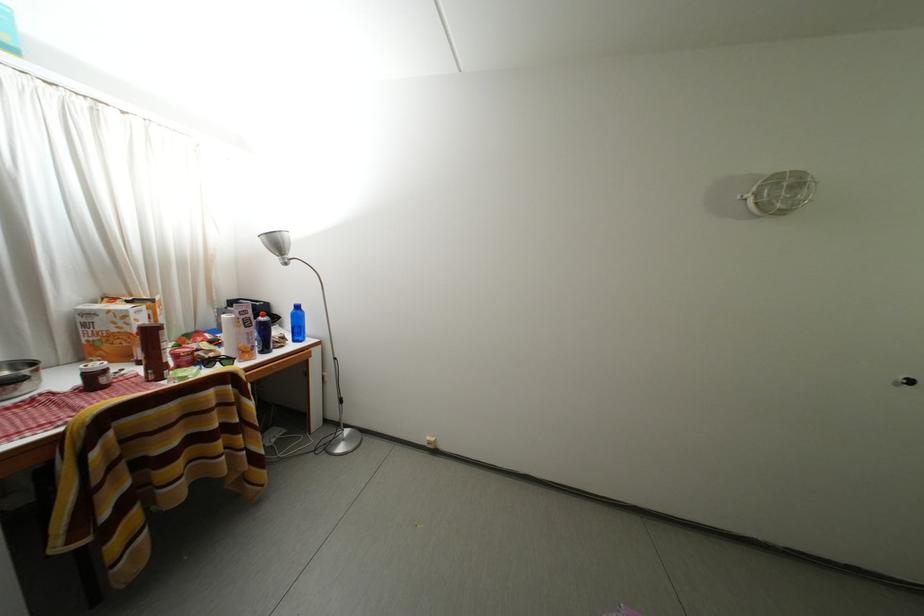
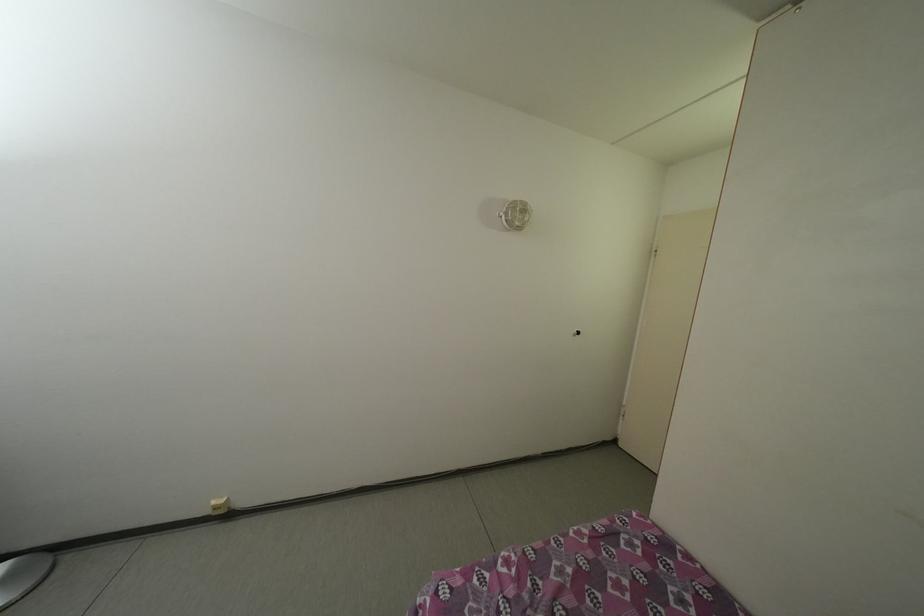
Locate, in the second image, the point that corresponds to point 436,444 in the first image.

(222, 508)